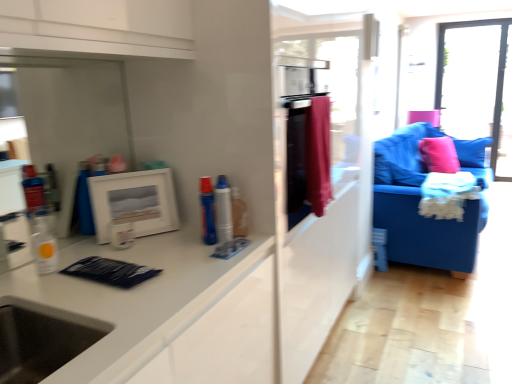
Question: Is blue plastic toothpaste at center, the 2th toiletry when ordered from left to right, smaller than transparent glass window at upper right?

Choices:
 (A) no
 (B) yes

Answer: (B)

Question: Would you consider blue plastic toothpaste at center, the 2th toiletry when ordered from left to right, to be distant from transparent glass window at upper right?

Choices:
 (A) yes
 (B) no

Answer: (A)

Question: Is blue plastic toothpaste at center, which appears as the 2th toiletry when viewed from the right, positioned with its back to transparent glass window at upper right?

Choices:
 (A) yes
 (B) no

Answer: (B)

Question: Can you confirm if blue plastic toothpaste at center, the 2th toiletry when ordered from left to right, is positioned to the right of transparent glass window at upper right?

Choices:
 (A) no
 (B) yes

Answer: (A)

Question: Can you confirm if blue plastic toothpaste at center, which appears as the 2th toiletry when viewed from the right, is thinner than transparent glass window at upper right?

Choices:
 (A) no
 (B) yes

Answer: (B)

Question: Is velvet red curtain at center wider or thinner than blue fabric couch at right?

Choices:
 (A) wide
 (B) thin

Answer: (B)

Question: In the image, is velvet red curtain at center on the left side or the right side of blue fabric couch at right?

Choices:
 (A) right
 (B) left

Answer: (B)

Question: From the image's perspective, is velvet red curtain at center positioned above or below blue fabric couch at right?

Choices:
 (A) above
 (B) below

Answer: (A)

Question: Is velvet red curtain at center spatially inside blue fabric couch at right, or outside of it?

Choices:
 (A) inside
 (B) outside

Answer: (B)

Question: Is point (166, 205) positioned closer to the camera than point (208, 198)?

Choices:
 (A) farther
 (B) closer

Answer: (A)

Question: Is white matte picture frame at upper left to the left or to the right of blue plastic toothpaste at center, the 2th toiletry when ordered from left to right, in the image?

Choices:
 (A) left
 (B) right

Answer: (A)

Question: From a real-world perspective, is white matte picture frame at upper left positioned above or below blue plastic toothpaste at center, which appears as the 2th toiletry when viewed from the right?

Choices:
 (A) above
 (B) below

Answer: (A)

Question: From the image's perspective, relative to blue plastic toothpaste at center, which appears as the 2th toiletry when viewed from the right, is white matte picture frame at upper left above or below?

Choices:
 (A) above
 (B) below

Answer: (A)

Question: Considering their positions, is pink fabric pillow at right located in front of or behind transparent plastic bottle at left, placed as the 3th toiletry when sorted from right to left?

Choices:
 (A) behind
 (B) front

Answer: (A)

Question: In terms of width, does pink fabric pillow at right look wider or thinner when compared to transparent plastic bottle at left, placed as the 3th toiletry when sorted from right to left?

Choices:
 (A) thin
 (B) wide

Answer: (B)